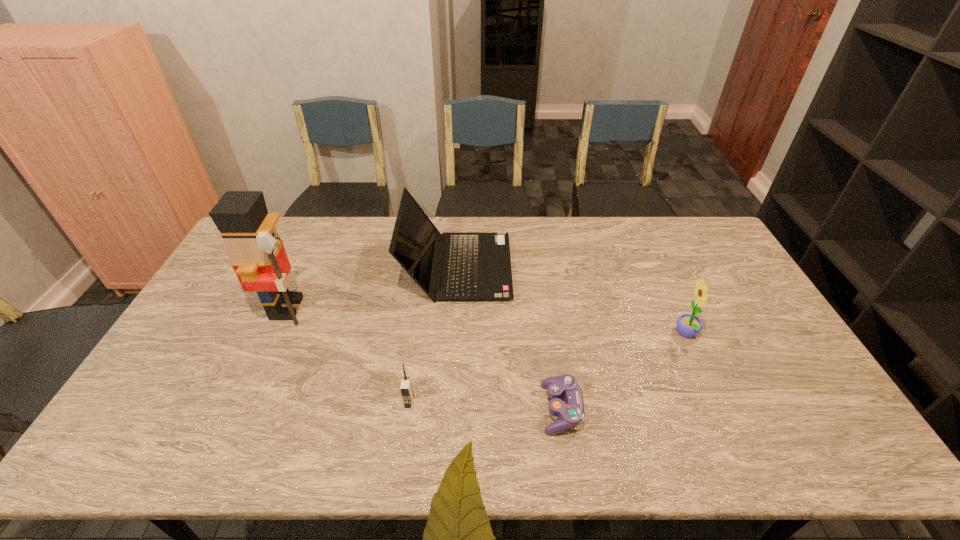
Point out which object is positioned as the third nearest to the laptop computer. Please provide its 2D coordinates. Your answer should be formatted as a tuple, i.e. [(x, y)], where the tuple contains the x and y coordinates of a point satisfying the conditions above.

[(406, 390)]

Select which object appears as the second closest to the laptop computer. Please provide its 2D coordinates. Your answer should be formatted as a tuple, i.e. [(x, y)], where the tuple contains the x and y coordinates of a point satisfying the conditions above.

[(570, 413)]

The width and height of the screenshot is (960, 540). Identify the location of free space that satisfies the following two spatial constraints: 1. in front of the shortest object holding the staff; 2. on the left side of the tallest object. 242,409.

Where is `free space that satisfies the following two spatial constraints: 1. on the front-facing side of the sunflower; 2. on the front-facing side of the second shortest object`? free space that satisfies the following two spatial constraints: 1. on the front-facing side of the sunflower; 2. on the front-facing side of the second shortest object is located at coordinates (717, 404).

At what (x,y) coordinates should I click in order to perform the action: click on free space that satisfies the following two spatial constraints: 1. on the screen of the laptop computer; 2. on the left side of the control. Please return your answer as a coordinate pair (x, y). Looking at the image, I should click on (449, 409).